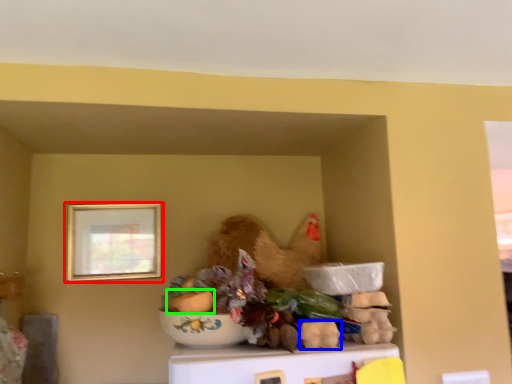
Question: Which object is the farthest from picture frame (highlighted by a red box)? Choose among these: food (highlighted by a blue box) or food (highlighted by a green box).

Choices:
 (A) food
 (B) food

Answer: (A)